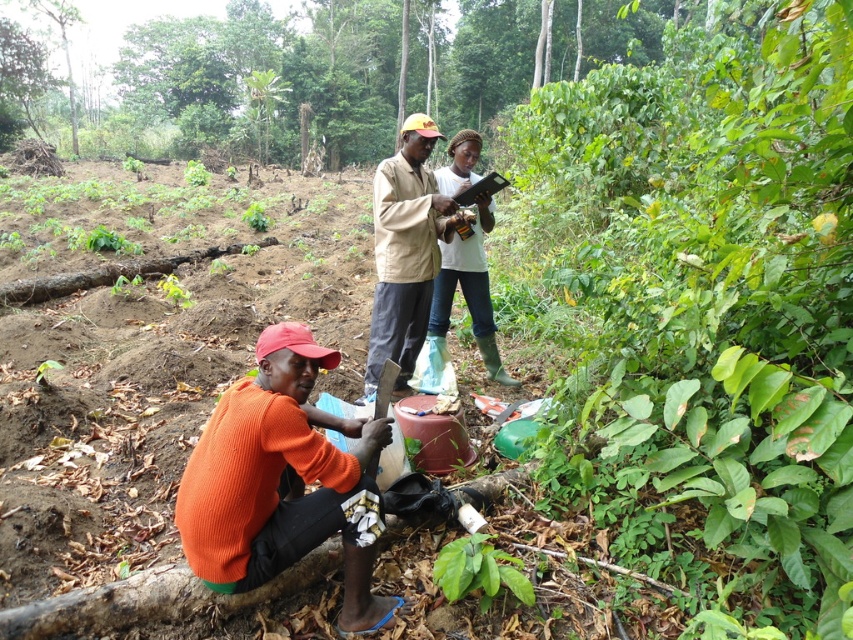
Question: Can you confirm if green leafy plant at lower center is positioned to the right of green leafy tree at upper left?

Choices:
 (A) no
 (B) yes

Answer: (B)

Question: Does white matte shirt at center have a lesser width compared to green leafy plant at lower center?

Choices:
 (A) no
 (B) yes

Answer: (A)

Question: Which point is farther from the camera taking this photo?

Choices:
 (A) click(x=294, y=490)
 (B) click(x=453, y=579)

Answer: (A)

Question: Which is nearer to the green leafy tree at upper left?

Choices:
 (A) green leafy plant at lower center
 (B) beige fabric shirt at center

Answer: (A)

Question: Which of the following is the farthest from the observer?

Choices:
 (A) (73, 145)
 (B) (282, 403)
 (C) (486, 596)
 (D) (409, 333)

Answer: (A)

Question: Is green leafy plant at lower center thinner than green leafy tree at upper left?

Choices:
 (A) no
 (B) yes

Answer: (B)